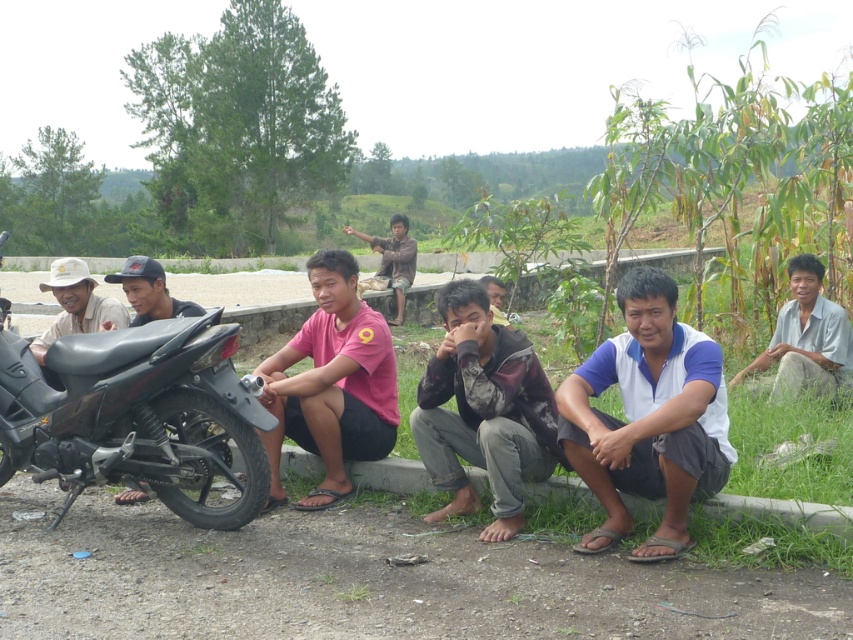
Can you confirm if camouflage fabric shirt at center is shorter than matte white hat at left?

No.

Is camouflage fabric shirt at center smaller than matte white hat at left?

No.

The width and height of the screenshot is (853, 640). I want to click on camouflage fabric shirt at center, so click(x=483, y=412).

Does white cotton shirt at center have a lesser height compared to glossy black motorcycle at left?

No, white cotton shirt at center is not shorter than glossy black motorcycle at left.

Can you confirm if white cotton shirt at center is taller than glossy black motorcycle at left?

Correct, white cotton shirt at center is much taller as glossy black motorcycle at left.

Find the location of a particular element. The image size is (853, 640). white cotton shirt at center is located at coordinates click(x=648, y=419).

Is point (776, 323) positioned behind point (85, 298)?

Yes, point (776, 323) is farther from viewer.

Between gray cotton shirt at lower right and matte white hat at left, which one appears on the left side from the viewer's perspective?

matte white hat at left is more to the left.

The height and width of the screenshot is (640, 853). I want to click on gray cotton shirt at lower right, so click(x=805, y=339).